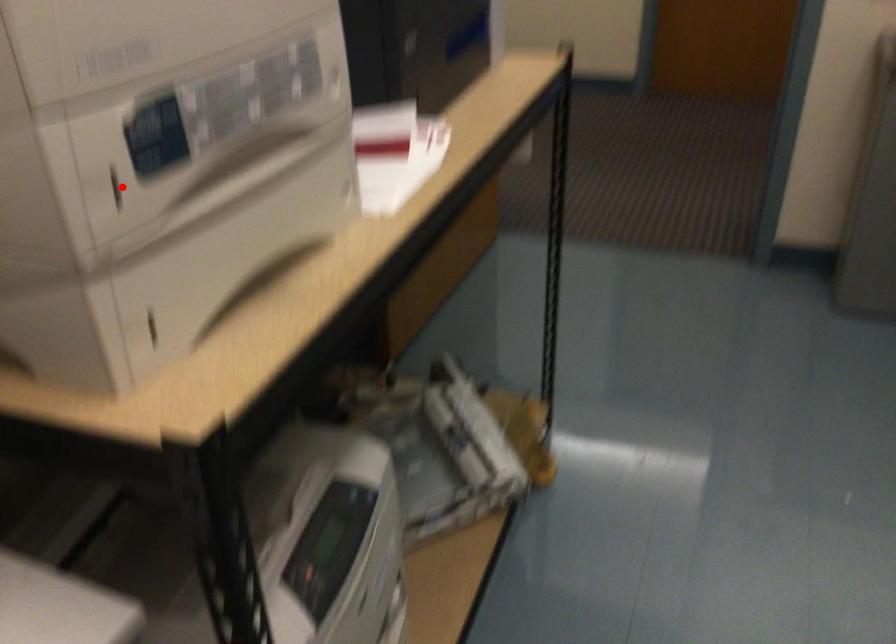
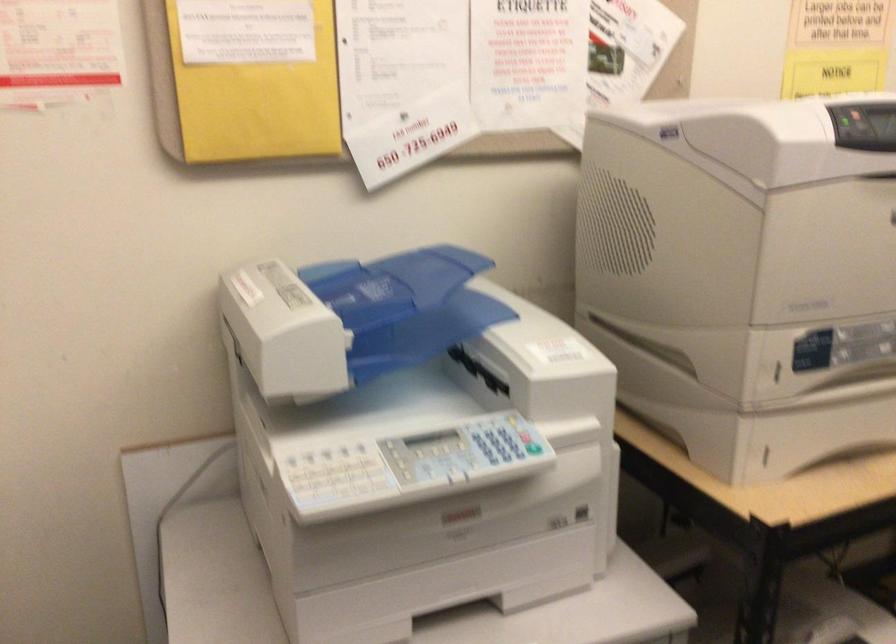
Question: I am providing you with two images of the same scene from different viewpoints. Given a red point in image1, look at the same physical point in image2. Is it:

Choices:
 (A) Closer to the viewpoint
 (B) Farther from the viewpoint

Answer: (B)